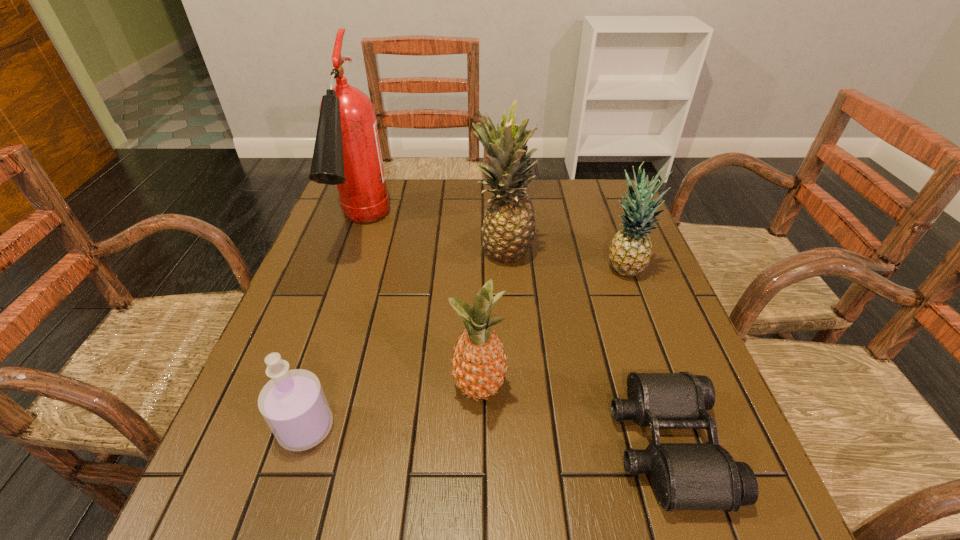
This screenshot has height=540, width=960. Find the location of `fire extinguisher`. fire extinguisher is located at coordinates (347, 153).

At what (x,y) coordinates should I click in order to perform the action: click on the second tallest object. Please return your answer as a coordinate pair (x, y). This screenshot has width=960, height=540. Looking at the image, I should click on (508, 231).

The width and height of the screenshot is (960, 540). I want to click on the rightmost pineapple, so click(x=631, y=248).

At what (x,y) coordinates should I click in order to perform the action: click on the nearest pineapple. Please return your answer as a coordinate pair (x, y). The height and width of the screenshot is (540, 960). Looking at the image, I should click on (478, 365).

At what (x,y) coordinates should I click in order to perform the action: click on perfume. Please return your answer as a coordinate pair (x, y). The width and height of the screenshot is (960, 540). Looking at the image, I should click on (293, 403).

Image resolution: width=960 pixels, height=540 pixels. In order to click on binoculars in this screenshot , I will do (x=685, y=476).

I want to click on free location located at the nozzle end of the fire extinguisher, so [306, 394].

In order to click on vacant area located 0.150m on the left of the tallest pineapple in this screenshot , I will do `click(418, 251)`.

Locate an element on the screen. Image resolution: width=960 pixels, height=540 pixels. vacant space located on the back of the rightmost pineapple is located at coordinates (606, 220).

Where is `free region located 0.080m on the back of the nearest pineapple`? The width and height of the screenshot is (960, 540). free region located 0.080m on the back of the nearest pineapple is located at coordinates (479, 335).